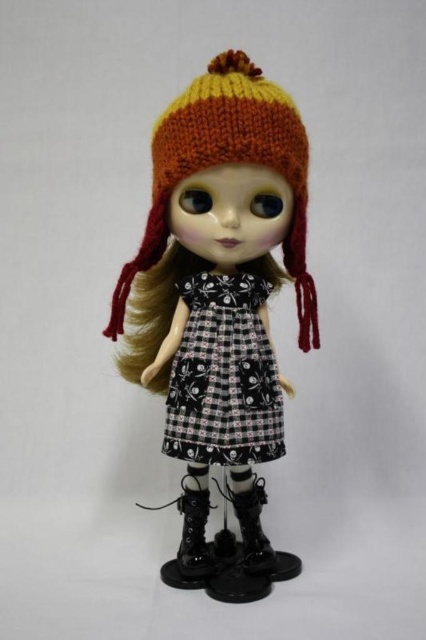
The image size is (426, 640). Describe the element at coordinates (219, 301) in the screenshot. I see `knitted woolen hat at center` at that location.

Does knitted woolen hat at center appear on the left side of black printed fabric dress at center?

Indeed, knitted woolen hat at center is positioned on the left side of black printed fabric dress at center.

Is point (249, 92) closer to camera compared to point (218, 452)?

Yes, it is.

The width and height of the screenshot is (426, 640). Find the location of `knitted woolen hat at center`. knitted woolen hat at center is located at coordinates (219, 301).

Between point (241, 52) and point (172, 573), which one is positioned behind?

The point (172, 573) is more distant.

Who is more distant from viewer, (261, 189) or (187, 472)?

Positioned behind is point (187, 472).

The image size is (426, 640). Identify the location of knitted woolen hat at center. (219, 301).

Does black printed fabric dress at center lie behind black leather boot at lower center?

No, black printed fabric dress at center is in front of black leather boot at lower center.

Locate an element on the screen. Image resolution: width=426 pixels, height=640 pixels. black printed fabric dress at center is located at coordinates (224, 376).

What do you see at coordinates (224, 376) in the screenshot?
I see `black printed fabric dress at center` at bounding box center [224, 376].

This screenshot has height=640, width=426. Identify the location of black printed fabric dress at center. (224, 376).